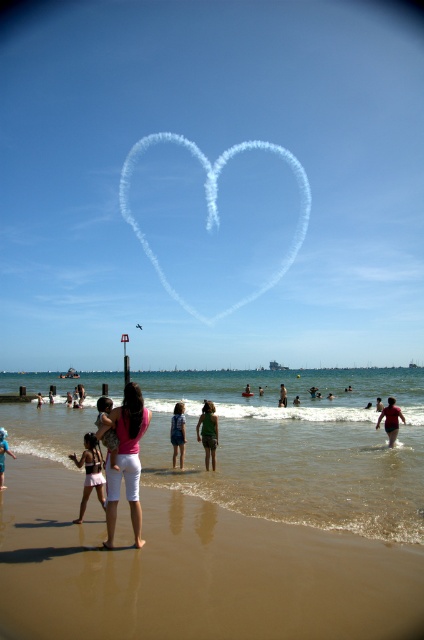
Question: Which point appears farthest from the camera in this image?

Choices:
 (A) (343, 467)
 (B) (278, 400)

Answer: (B)

Question: Can you confirm if green fabric shirt at center is positioned to the left of green fabric shorts at center?

Choices:
 (A) no
 (B) yes

Answer: (B)

Question: Can you confirm if brown sand at lower center is positioned below denim shorts at center?

Choices:
 (A) yes
 (B) no

Answer: (A)

Question: Which point is closer to the camera?

Choices:
 (A) white cotton shorts at lower left
 (B) white smoke heart at center

Answer: (A)

Question: Does brown sandy beach at lower center appear on the right side of white smoke heart at center?

Choices:
 (A) no
 (B) yes

Answer: (B)

Question: Which point appears farthest from the camera in this image?

Choices:
 (A) (84, 445)
 (B) (371, 531)
 (C) (390, 435)
 (D) (354, 595)

Answer: (C)